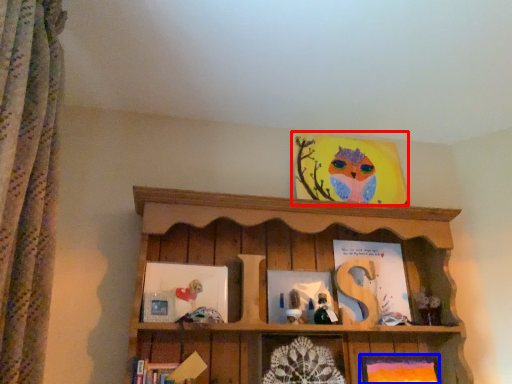
Question: Which of the following is the farthest to the observer, picture frame (highlighted by a red box) or picture frame (highlighted by a blue box)?

Choices:
 (A) picture frame
 (B) picture frame

Answer: (A)